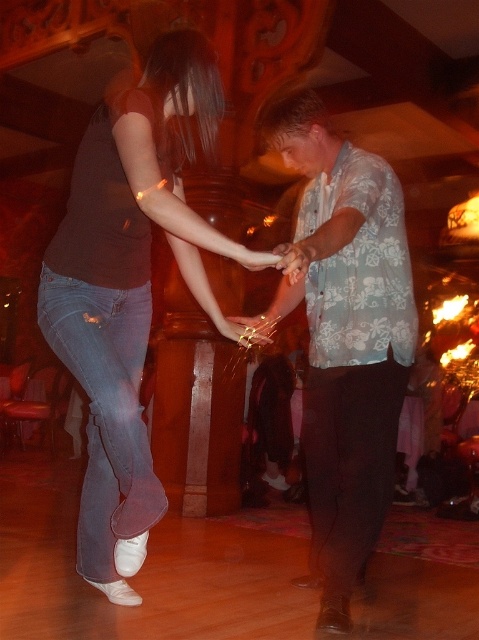
Between denim jeans at center and denim at left, which one has less height?

denim at left is shorter.

You are a GUI agent. You are given a task and a screenshot of the screen. Output one action in this format:
    pyautogui.click(x=<x>, y=<y>)
    Task: Click on the denim jeans at center
    The height and width of the screenshot is (640, 479).
    Given the screenshot: What is the action you would take?
    pyautogui.click(x=128, y=289)

This screenshot has height=640, width=479. I want to click on denim jeans at center, so click(128, 289).

Locate an element on the screen. The height and width of the screenshot is (640, 479). denim jeans at center is located at coordinates (128, 289).

Which of these two, floral print shirt at center or metallic ring at center, stands taller?

floral print shirt at center is taller.

Does point (316, 422) come in front of point (248, 326)?

No, it is not.

I want to click on floral print shirt at center, so click(x=344, y=339).

Does floral print shirt at center appear on the right side of denim at left?

Correct, you'll find floral print shirt at center to the right of denim at left.

Can you confirm if floral print shirt at center is shorter than denim at left?

No, floral print shirt at center is not shorter than denim at left.

This screenshot has height=640, width=479. What do you see at coordinates (344, 339) in the screenshot? I see `floral print shirt at center` at bounding box center [344, 339].

Locate an element on the screen. The width and height of the screenshot is (479, 640). floral print shirt at center is located at coordinates (344, 339).